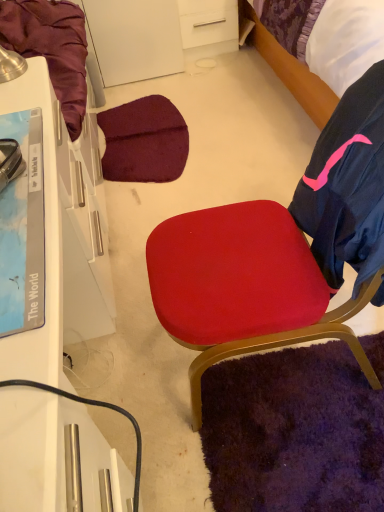
Question: Can you confirm if matte red cushion at center is taller than white glossy desk at left?

Choices:
 (A) no
 (B) yes

Answer: (B)

Question: Is matte red cushion at center behind white glossy desk at left?

Choices:
 (A) yes
 (B) no

Answer: (A)

Question: From the image's perspective, is matte red cushion at center below white glossy desk at left?

Choices:
 (A) no
 (B) yes

Answer: (A)

Question: Is matte red cushion at center smaller than white glossy desk at left?

Choices:
 (A) no
 (B) yes

Answer: (B)

Question: From a real-world perspective, is matte red cushion at center located beneath white glossy desk at left?

Choices:
 (A) yes
 (B) no

Answer: (B)

Question: Can you confirm if matte red cushion at center is positioned to the right of white glossy desk at left?

Choices:
 (A) yes
 (B) no

Answer: (A)

Question: Does purple fabric bed at upper right have a greater height compared to white glossy desk at left?

Choices:
 (A) no
 (B) yes

Answer: (A)

Question: From a real-world perspective, is purple fabric bed at upper right beneath white glossy desk at left?

Choices:
 (A) no
 (B) yes

Answer: (B)

Question: Can you confirm if purple fabric bed at upper right is shorter than white glossy desk at left?

Choices:
 (A) no
 (B) yes

Answer: (B)

Question: Does purple fabric bed at upper right have a smaller size compared to white glossy desk at left?

Choices:
 (A) no
 (B) yes

Answer: (A)

Question: Considering the relative positions of purple fabric bed at upper right and white glossy desk at left in the image provided, is purple fabric bed at upper right to the right of white glossy desk at left from the viewer's perspective?

Choices:
 (A) no
 (B) yes

Answer: (B)

Question: From a real-world perspective, does purple fabric bed at upper right stand above white glossy desk at left?

Choices:
 (A) yes
 (B) no

Answer: (B)

Question: Does white glossy desk at left appear on the right side of matte red cushion at center?

Choices:
 (A) no
 (B) yes

Answer: (A)